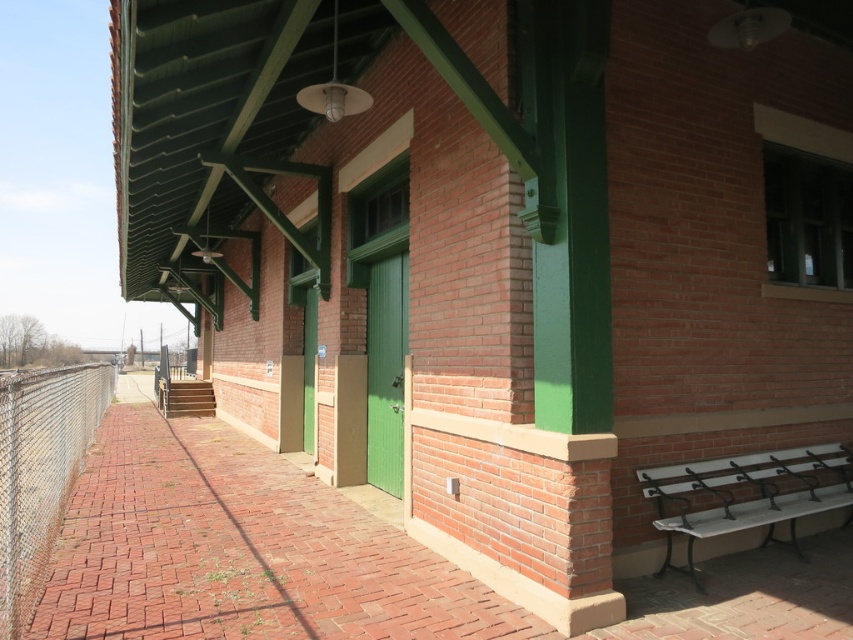
Question: Which point is farther to the camera?

Choices:
 (A) chain-link fence at left
 (B) white metal bench at lower right

Answer: (B)

Question: Among these points, which one is farthest from the camera?

Choices:
 (A) (688, 481)
 (B) (0, 493)

Answer: (A)

Question: Can you confirm if chain-link fence at left is bigger than white metal bench at lower right?

Choices:
 (A) no
 (B) yes

Answer: (B)

Question: Is chain-link fence at left in front of white metal bench at lower right?

Choices:
 (A) no
 (B) yes

Answer: (B)

Question: Is chain-link fence at left below white metal bench at lower right?

Choices:
 (A) yes
 (B) no

Answer: (A)